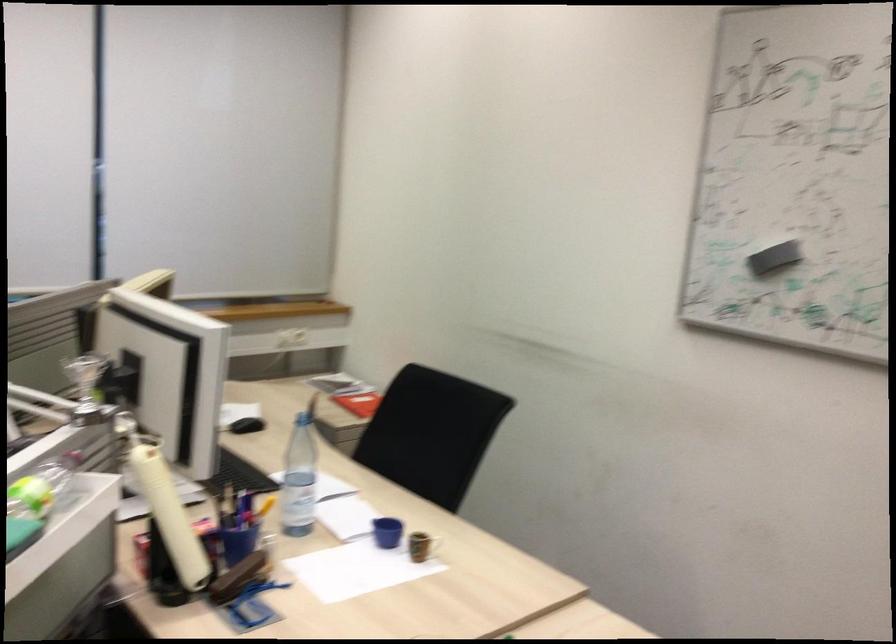
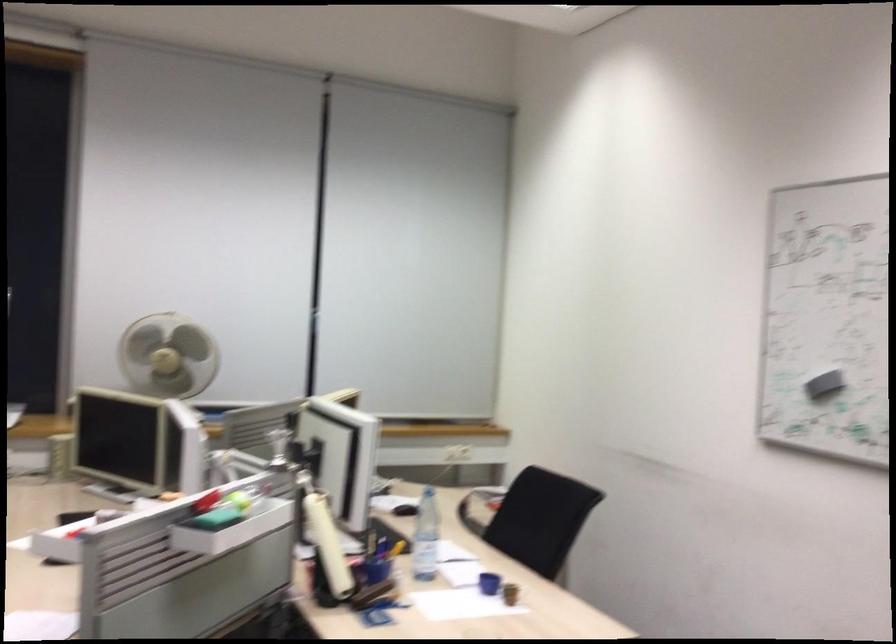
Question: The camera is either moving clockwise (left) or counter-clockwise (right) around the object. The first image is from the beginning of the video and the second image is from the end. Is the camera moving left or right when shooting the video?

Choices:
 (A) Left
 (B) Right

Answer: (B)